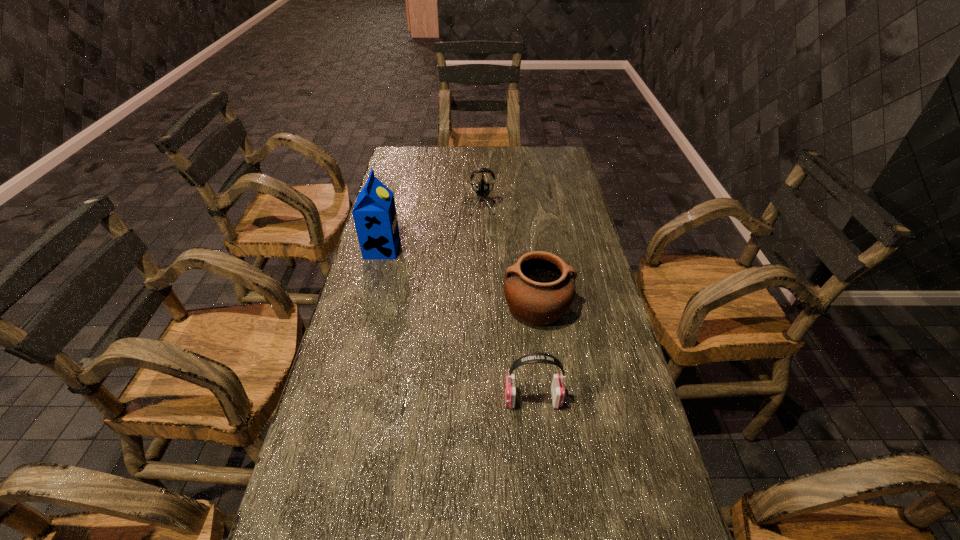
Where is `the second farthest object`? the second farthest object is located at coordinates (374, 213).

Identify the location of the leftmost object. The width and height of the screenshot is (960, 540). pyautogui.click(x=374, y=213).

Where is `the second object from left to right`? This screenshot has height=540, width=960. the second object from left to right is located at coordinates (482, 188).

Identify the location of the farther earphone. This screenshot has width=960, height=540. (482, 188).

Where is `the nearest object`? This screenshot has height=540, width=960. the nearest object is located at coordinates (557, 387).

At what (x,y) coordinates should I click in order to perform the action: click on the right earphone. Please return your answer as a coordinate pair (x, y). The width and height of the screenshot is (960, 540). Looking at the image, I should click on (557, 387).

The height and width of the screenshot is (540, 960). Identify the location of the second nearest object. (539, 288).

Locate an element on the screen. free space located with the cap open on the carton is located at coordinates (455, 249).

The width and height of the screenshot is (960, 540). Identify the location of vacant space positioned 0.220m on the front of the left earphone. (479, 253).

Where is `vacant area situated on the outer surface of the nearer earphone`? Image resolution: width=960 pixels, height=540 pixels. vacant area situated on the outer surface of the nearer earphone is located at coordinates (465, 399).